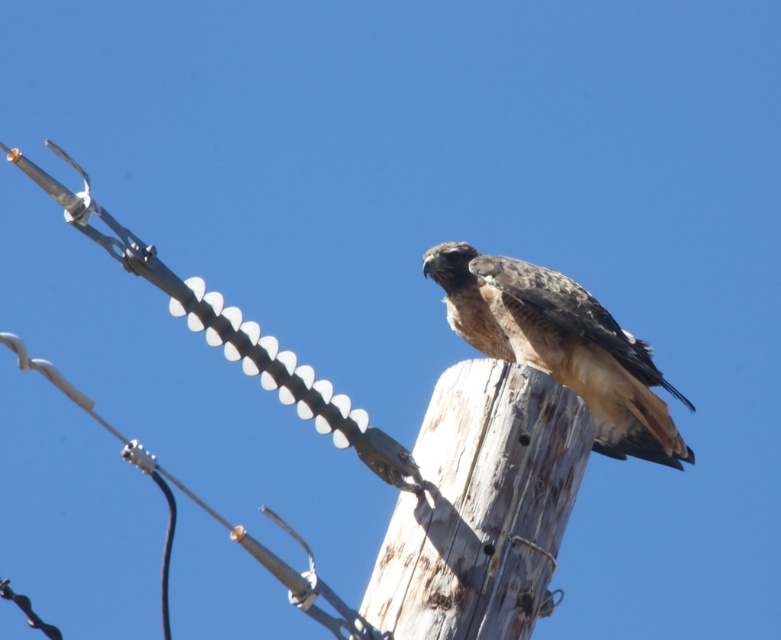
You are standing in a field and see the weathered wood pole at center and the brown feathered falcon at center. Which object is closer to you?

The weathered wood pole at center is closer to you because it is in front of the brown feathered falcon at center.

You are standing at the camera position and want to take a photo of the bird on the utility pole. If you move forward by 2 meters, how far will you be from the point at coordinates point (526, 444)?

The point at coordinates point (526, 444) is 6.11 meters away from the camera. If you move forward by 2 meters, you will be 6.11 meters minus 2 meters, which equals 4.11 meters away from the point at coordinates point (526, 444).

You are standing in front of the utility pole with the hawk. There are two points marked on the pole at coordinates point [522,440] and point [558,352]. Which point is nearer to you?

Point [522,440] is closer to the camera than point [558,352], so the point at [522,440] is nearer to you.